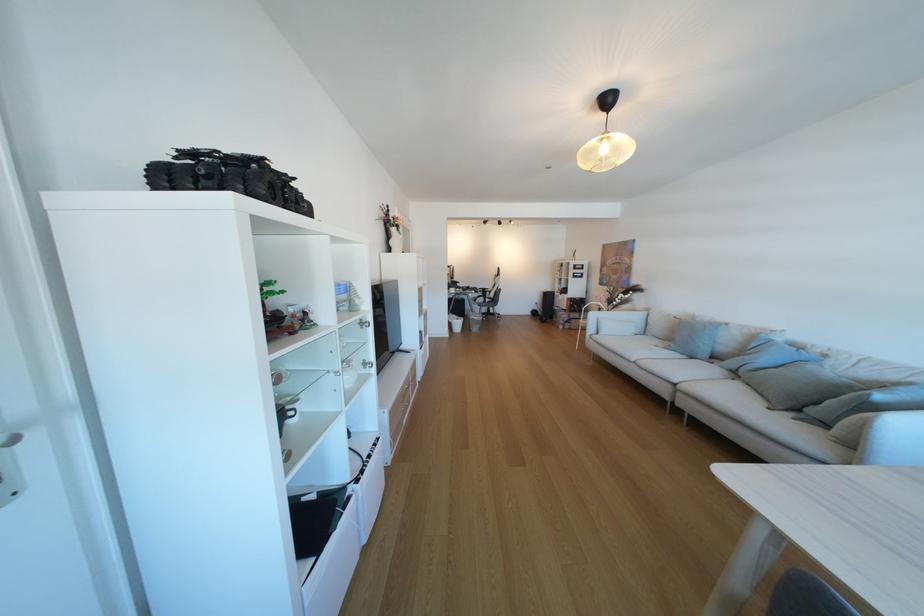
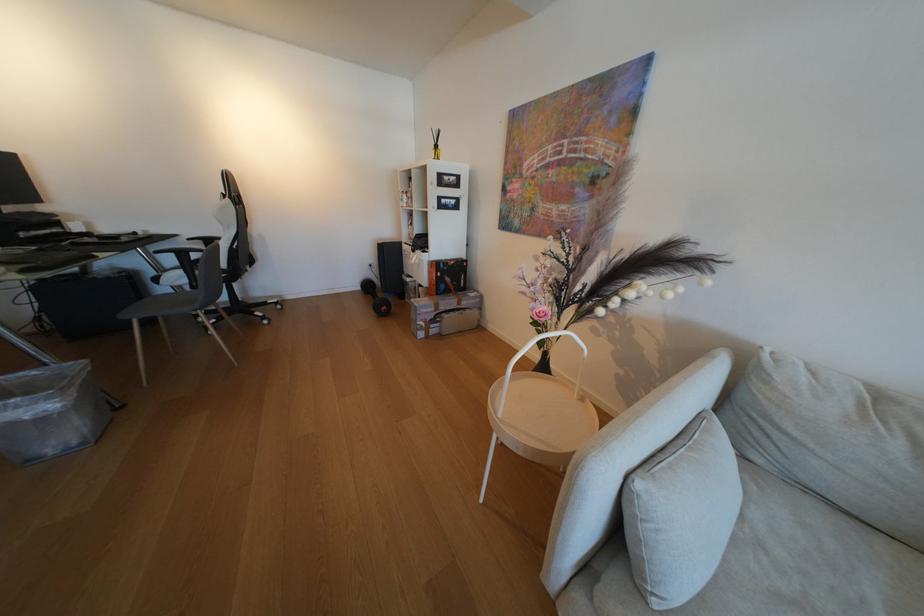
Where in the second image is the point corresponding to (x=578, y=323) from the first image?

(444, 322)